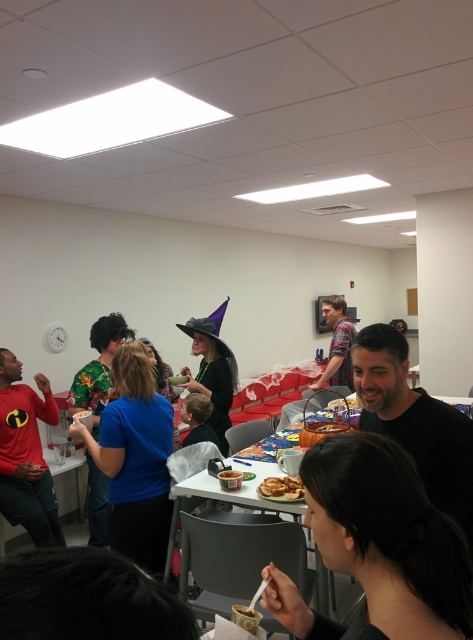
Question: Which is farther from the red matte shirt at left?

Choices:
 (A) matte black witch hat at center
 (B) floral fabric shirt at center

Answer: (A)

Question: Among these points, which one is farthest from the camera?

Choices:
 (A) (x=202, y=349)
 (B) (x=1, y=472)
 (C) (x=96, y=406)
 (D) (x=341, y=376)

Answer: (D)

Question: Is red matte shirt at left above floral fabric shirt at center?

Choices:
 (A) no
 (B) yes

Answer: (B)

Question: Which point appears closest to the camera in this image?

Choices:
 (A) (348, 360)
 (B) (272, 499)
 (C) (79, 378)

Answer: (B)

Question: Does black matte hair at lower right appear on the right side of plaid shirt at center?

Choices:
 (A) no
 (B) yes

Answer: (A)

Question: Can you confirm if red matte shirt at left is positioned above matte black witch hat at center?

Choices:
 (A) yes
 (B) no

Answer: (B)